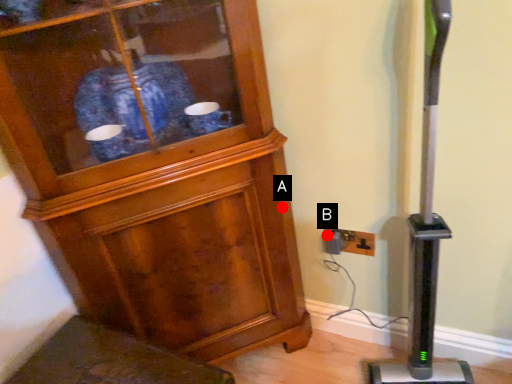
Question: Two points are circled on the image, labeled by A and B beside each circle. Which of the following is the closest to the observer?

Choices:
 (A) A is closer
 (B) B is closer

Answer: (A)